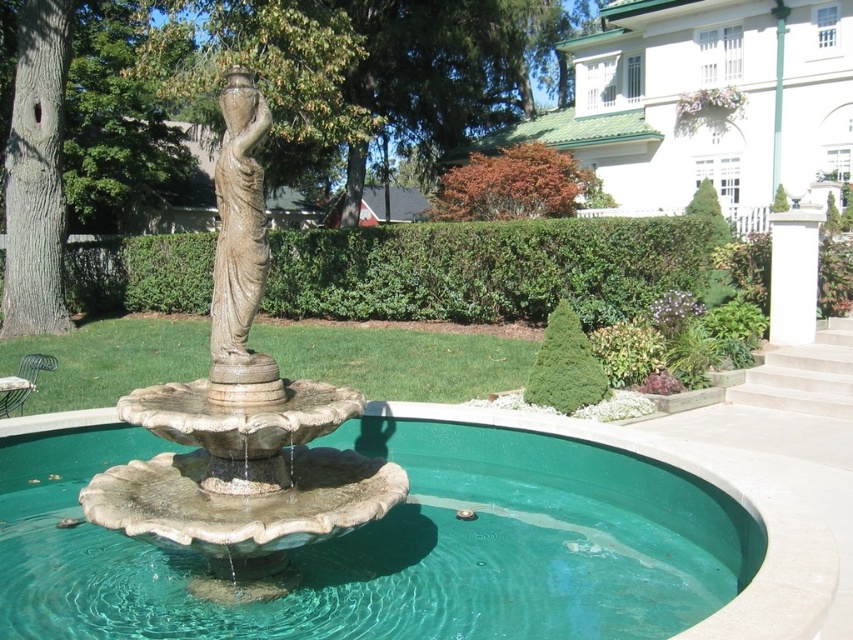
What are the coordinates of the stone statue at center?

The stone statue at center is located at coordinates point (241, 419).

You are designing a new garden layout and need to place a 3D model of the garden. The garden has a stone statue at center and a matte bronze statue at center. Which statue has a smaller width?

The stone statue at center has a smaller width than the matte bronze statue at center.